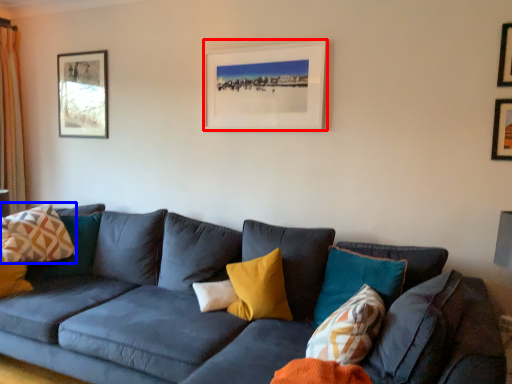
Question: Which object appears closest to the camera in this image, picture frame (highlighted by a red box) or pillow (highlighted by a blue box)?

Choices:
 (A) picture frame
 (B) pillow

Answer: (A)